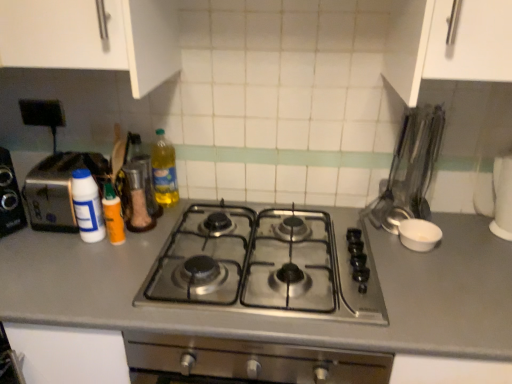
Locate an element on the screen. The height and width of the screenshot is (384, 512). vacant area that is in front of metallic silver utensils at right, the first appliance positioned from the top is located at coordinates (423, 255).